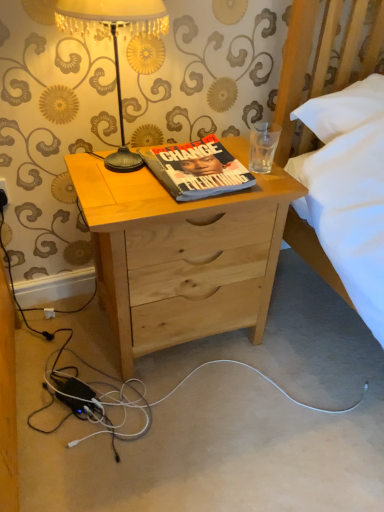
Question: Is gold textured lampshade at upper left at the left side of natural wood nightstand at center?

Choices:
 (A) yes
 (B) no

Answer: (A)

Question: From the image's perspective, is gold textured lampshade at upper left located above natural wood nightstand at center?

Choices:
 (A) yes
 (B) no

Answer: (A)

Question: Can you confirm if gold textured lampshade at upper left is smaller than natural wood nightstand at center?

Choices:
 (A) no
 (B) yes

Answer: (B)

Question: From a real-world perspective, is gold textured lampshade at upper left located beneath natural wood nightstand at center?

Choices:
 (A) yes
 (B) no

Answer: (B)

Question: Can you confirm if gold textured lampshade at upper left is bigger than natural wood nightstand at center?

Choices:
 (A) no
 (B) yes

Answer: (A)

Question: Is point (210, 268) closer or farther from the camera than point (129, 28)?

Choices:
 (A) farther
 (B) closer

Answer: (A)

Question: Is natural wood nightstand at center inside the boundaries of gold textured lampshade at upper left, or outside?

Choices:
 (A) inside
 (B) outside

Answer: (B)

Question: From their relative heights in the image, would you say natural wood nightstand at center is taller or shorter than gold textured lampshade at upper left?

Choices:
 (A) short
 (B) tall

Answer: (B)

Question: Looking at their shapes, would you say natural wood nightstand at center is wider or thinner than gold textured lampshade at upper left?

Choices:
 (A) thin
 (B) wide

Answer: (B)

Question: From the image's perspective, is natural wood nightstand at center above or below hardcover book at center?

Choices:
 (A) below
 (B) above

Answer: (A)

Question: Is point coord(77,162) positioned closer to the camera than point coord(201,159)?

Choices:
 (A) farther
 (B) closer

Answer: (A)

Question: Considering their positions, is natural wood nightstand at center located in front of or behind hardcover book at center?

Choices:
 (A) front
 (B) behind

Answer: (A)

Question: From a real-world perspective, is natural wood nightstand at center above or below hardcover book at center?

Choices:
 (A) above
 (B) below

Answer: (B)

Question: Relative to natural wood nightstand at center, is hardcover book at center in front or behind?

Choices:
 (A) front
 (B) behind

Answer: (B)

Question: Do you think hardcover book at center is within natural wood nightstand at center, or outside of it?

Choices:
 (A) outside
 (B) inside

Answer: (A)